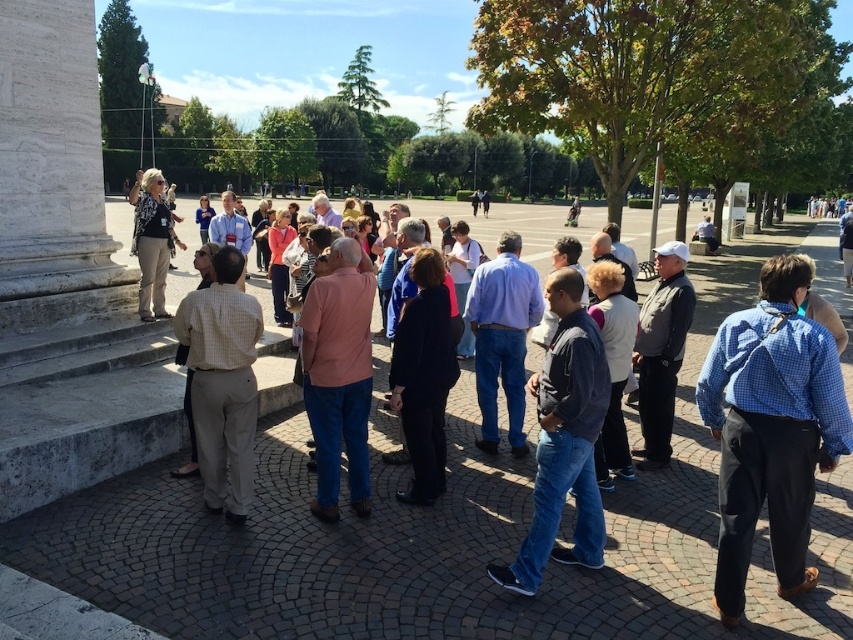
Question: Estimate the real-world distances between objects in this image. Which object is farther from the dark blue fabric coat at center?

Choices:
 (A) dark brown leather jacket at center
 (B) blue checkered shirt at center
 (C) matte pink sweater at center

Answer: (C)

Question: Which point appears farthest from the camera in this image?

Choices:
 (A) (624, 321)
 (B) (550, 461)
 (C) (804, 451)
 (D) (200, 240)

Answer: (D)

Question: Which object is positioned closest to the matte pink sweater at center?

Choices:
 (A) light beige scarf at upper left
 (B) blue denim jeans at lower center
 (C) checkered shirt at lower left

Answer: (A)

Question: Is blue checkered shirt at center thinner than denim jeans at center?

Choices:
 (A) yes
 (B) no

Answer: (B)

Question: Is blue checkered shirt at center wider than dark brown leather jacket at center?

Choices:
 (A) yes
 (B) no

Answer: (A)

Question: Is checkered shirt at lower left smaller than dark blue fabric coat at center?

Choices:
 (A) yes
 (B) no

Answer: (B)